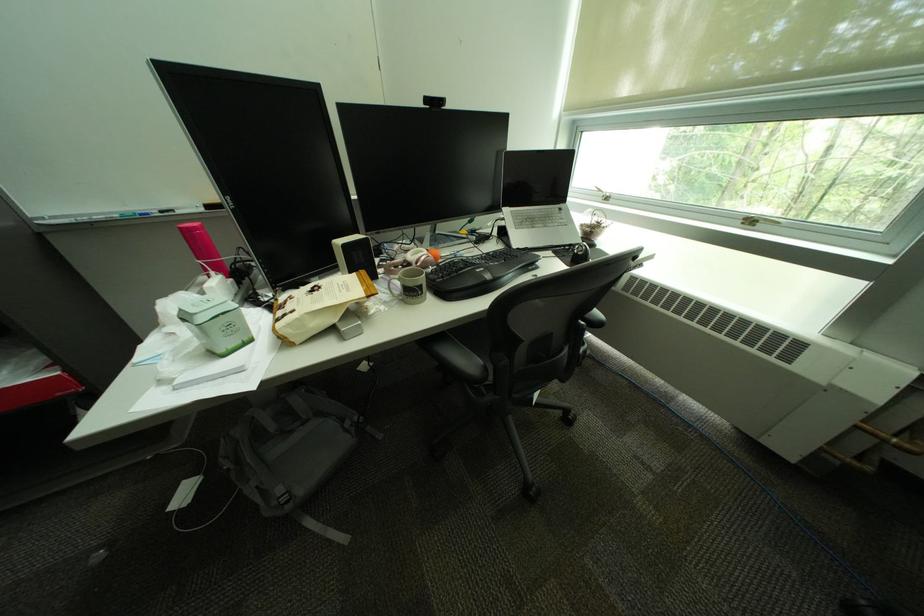
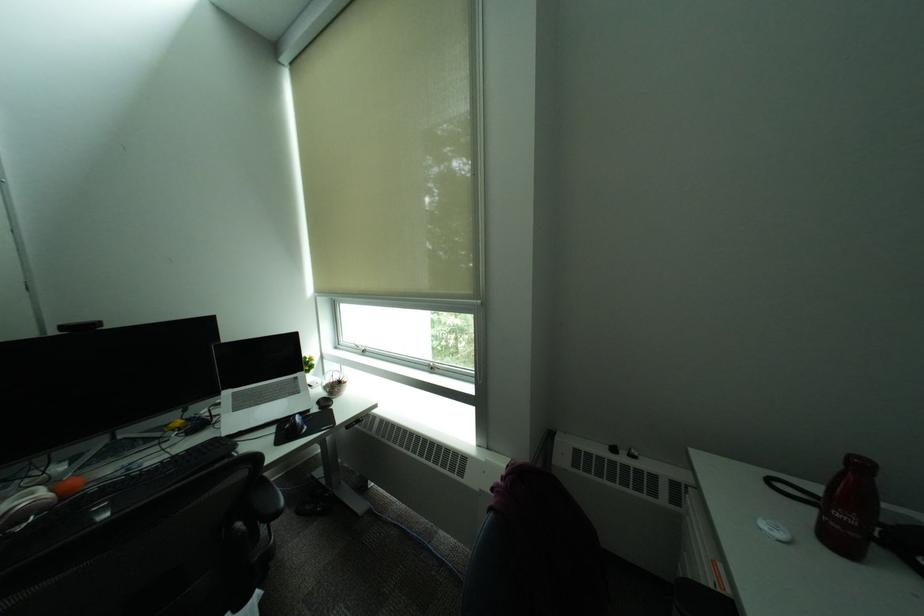
First-person continuous shooting, in which direction is the camera rotating?

The rotation direction of the camera is right-up.